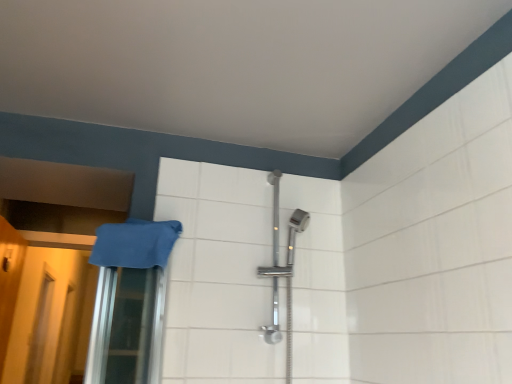
Question: From a real-world perspective, is translucent plastic screen door at lower left, the second screen door in the left-to-right sequence, positioned above or below translucent plastic screen door at lower left, the 1th screen door viewed from the back?

Choices:
 (A) above
 (B) below

Answer: (A)

Question: Considering the positions of translucent plastic screen door at lower left, the second screen door in the left-to-right sequence, and translucent plastic screen door at lower left, acting as the 2th screen door starting from the right, in the image, is translucent plastic screen door at lower left, the second screen door in the left-to-right sequence, wider or thinner than translucent plastic screen door at lower left, acting as the 2th screen door starting from the right,?

Choices:
 (A) thin
 (B) wide

Answer: (A)

Question: Which of these objects is positioned farthest from the translucent plastic screen door at lower left, the 1th screen door viewed from the back?

Choices:
 (A) yellow matte door at left
 (B) blue fabric towel at left
 (C) translucent plastic screen door at lower left, the 1th screen door when ordered from front to back

Answer: (B)

Question: Considering the real-world distances, which object is farthest from the yellow matte door at left?

Choices:
 (A) blue fabric towel at left
 (B) translucent plastic screen door at lower left, the first screen door when ordered from right to left
 (C) translucent plastic screen door at lower left, acting as the 2th screen door starting from the right

Answer: (A)